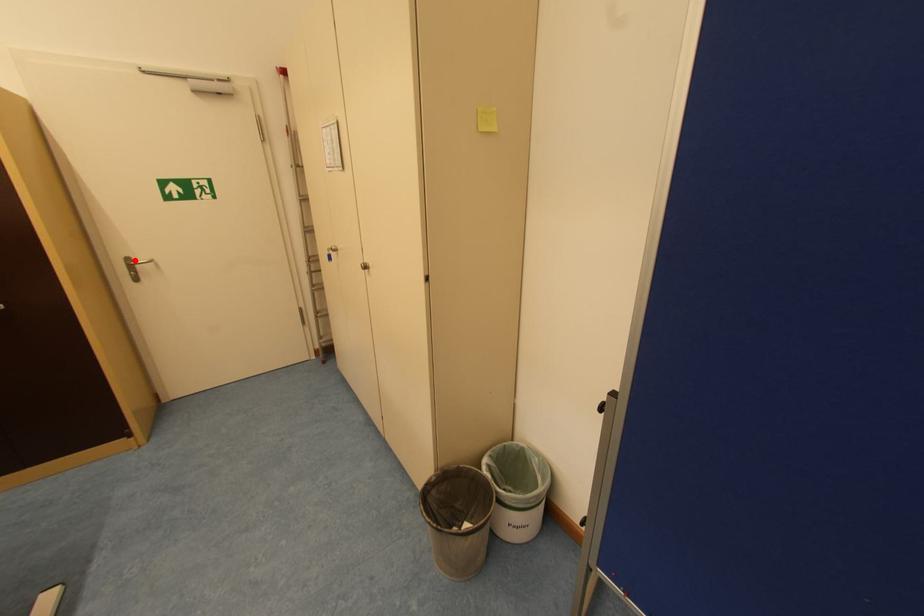
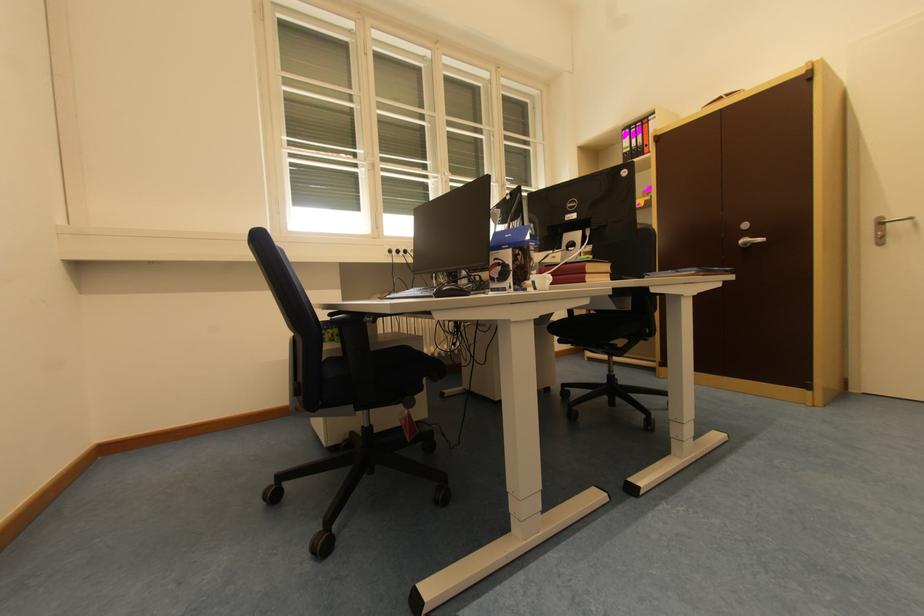
Where in the second image is the point corresponding to the highlighted location from the first image?

(888, 220)